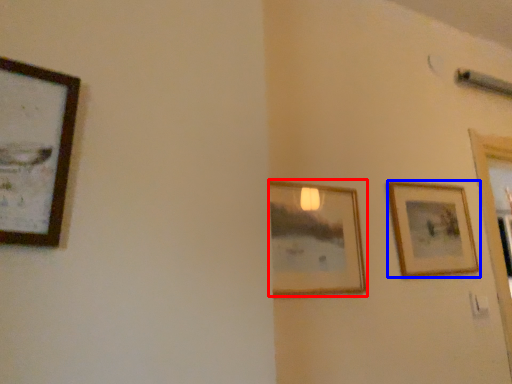
Question: Which of the following is the closest to the observer, picture frame (highlighted by a red box) or picture frame (highlighted by a blue box)?

Choices:
 (A) picture frame
 (B) picture frame

Answer: (A)